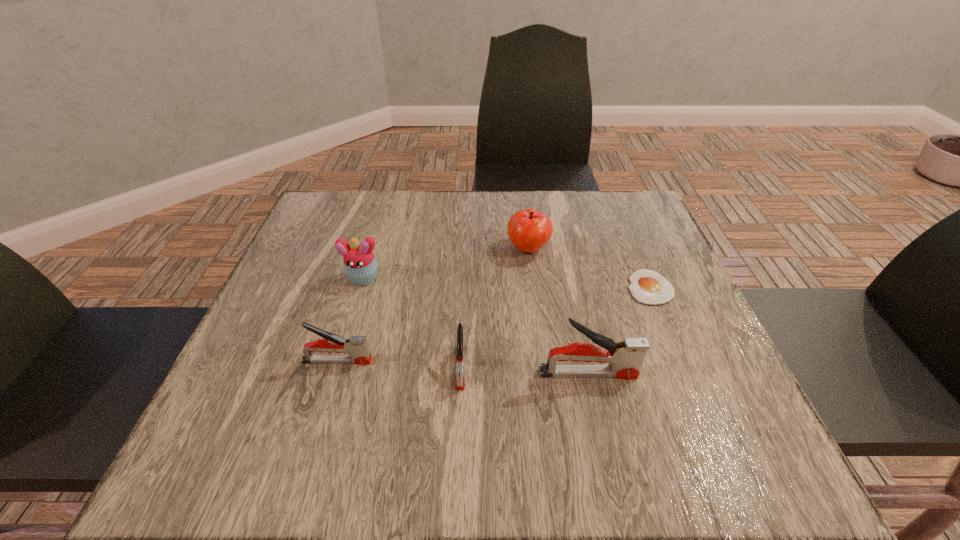
Where is `free space at the near edge`? The width and height of the screenshot is (960, 540). free space at the near edge is located at coordinates (512, 390).

Locate an element on the screen. The height and width of the screenshot is (540, 960). blank space at the left edge of the desktop is located at coordinates (304, 368).

At what (x,y) coordinates should I click in order to perform the action: click on free point at the right edge. Please return your answer as a coordinate pair (x, y). The height and width of the screenshot is (540, 960). Looking at the image, I should click on (687, 305).

The image size is (960, 540). I want to click on blank space at the far left corner of the desktop, so click(321, 218).

The width and height of the screenshot is (960, 540). In order to click on free space at the far right corner in this screenshot , I will do `click(620, 217)`.

Find the location of a particular element. free spot between the third object from left to right and the leftmost stapler is located at coordinates (399, 364).

Locate an element on the screen. Image resolution: width=960 pixels, height=540 pixels. free space that is in between the second shortest object and the cupcake is located at coordinates (412, 322).

The width and height of the screenshot is (960, 540). Identify the location of free space between the cupcake and the apple. (445, 264).

I want to click on vacant area that lies between the fourth object from right to left and the rightmost stapler, so click(x=524, y=370).

Locate an element on the screen. This screenshot has height=540, width=960. vacant region between the apple and the cupcake is located at coordinates (445, 264).